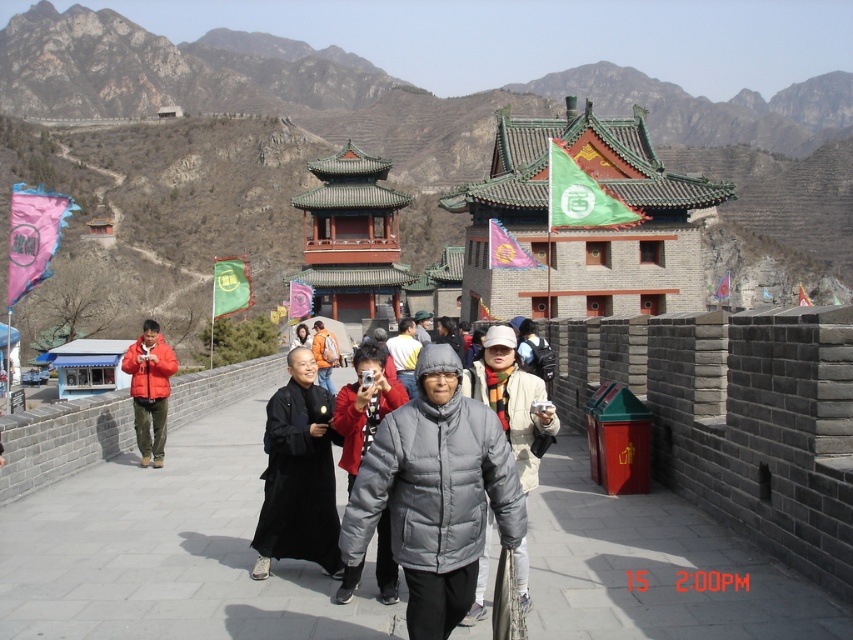
You are a photographer standing on the Great Wall and notice two jackets lying on the ground near the pathway. The jackets are the gray down jacket at center and the orange fabric jacket at center. Which jacket would be better for keeping warm in the cold weather?

The orange fabric jacket at center is thicker than the gray down jacket at center, so it would provide better warmth in cold weather.

You are a photographer standing on the Great Wall of China and want to take a photo of the gray down jacket at center and orange fabric jacket at center. Which jacket will appear larger in the photo?

The gray down jacket at center will appear larger in the photo because it is much taller than the orange fabric jacket at center.